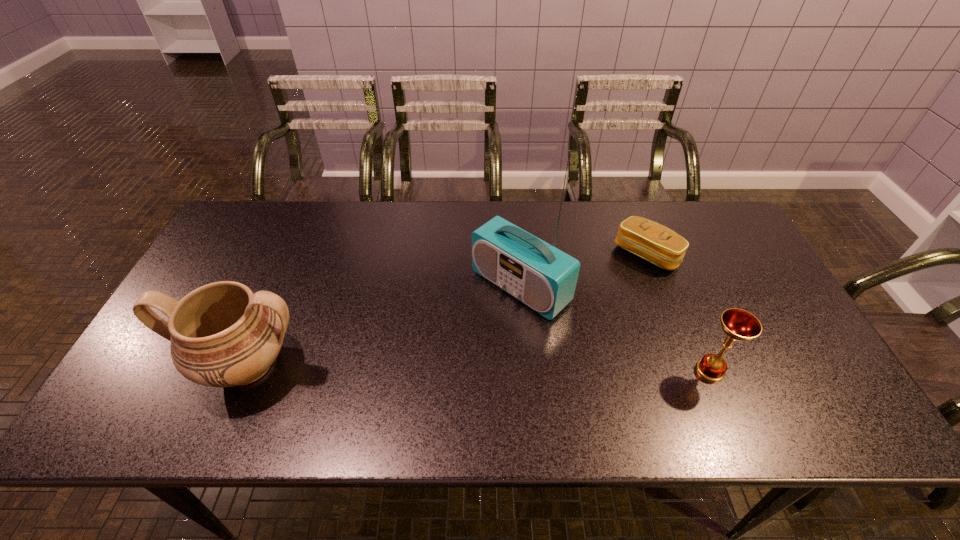
You are a GUI agent. You are given a task and a screenshot of the screen. Output one action in this format:
    pyautogui.click(x=<x>, y=<y>)
    Task: Click on the leftmost object
    This screenshot has width=960, height=540.
    Given the screenshot: What is the action you would take?
    pyautogui.click(x=222, y=334)

I want to click on urn, so click(222, 334).

Identify the location of the second shortest object. The height and width of the screenshot is (540, 960). 739,325.

This screenshot has width=960, height=540. I want to click on the tallest object, so click(544, 278).

This screenshot has height=540, width=960. I want to click on the third object from right to left, so click(544, 278).

This screenshot has height=540, width=960. Identify the location of the shortest object. (651, 241).

Where is `vacant area located on the back of the chalice`? vacant area located on the back of the chalice is located at coordinates (668, 271).

The height and width of the screenshot is (540, 960). I want to click on free space located 0.270m on the front panel of the second object from left to right, so click(413, 378).

Where is `vacant area located on the front panel of the second object from left to right`? The height and width of the screenshot is (540, 960). vacant area located on the front panel of the second object from left to right is located at coordinates (419, 373).

Find the location of `blank space located 0.060m on the front panel of the second object from left to right`. blank space located 0.060m on the front panel of the second object from left to right is located at coordinates (473, 326).